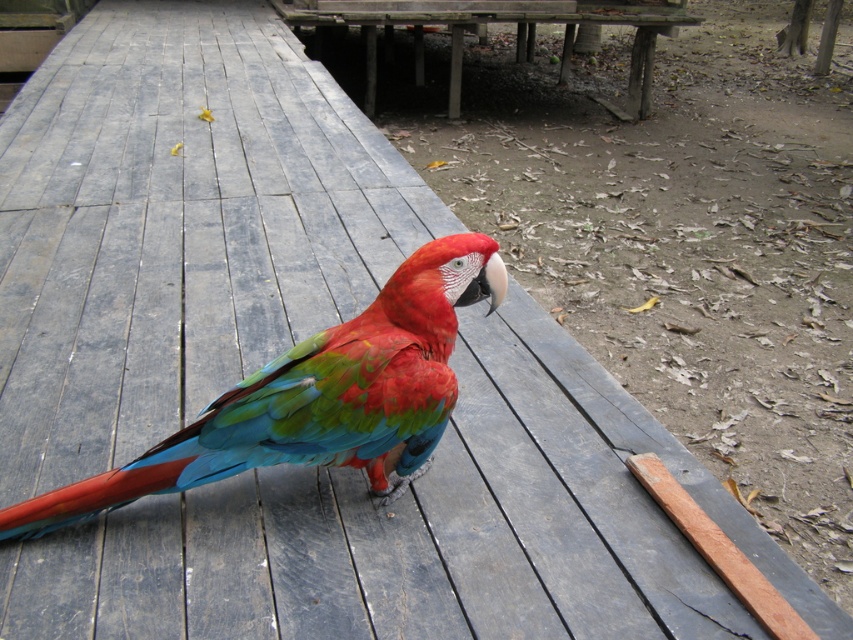
You are standing on the wooden deck and want to take a photo of the shiny multicolored parrot at center and the wooden picnic table at center. Which object should you focus on first if you want to capture both in the same frame without moving your camera?

The shiny multicolored parrot at center is to the left of the wooden picnic table at center, so you should focus on the parrot first to ensure both are in frame.

You are a small birdhouse that is 20 cm tall. You want to place yourself on the wooden picnic table at center so that the shiny multicolored parrot at center can see you easily. Is there enough vertical space between the parrot and the table to place the birdhouse?

The shiny multicolored parrot at center is not as tall as the wooden picnic table at center, so there is enough vertical space between them to place the 20 cm tall birdhouse.

You are a photographer trying to capture a closeup of the shiny multicolored parrot at center. The wooden picnic table at center is blocking your view. Can you estimate if the parrot can fit entirely in your camera frame if you move the table out of the way?

The shiny multicolored parrot at center is narrower than the wooden picnic table at center, so moving the table out of the way would allow the parrot to fit entirely within the camera frame since it is smaller in width.